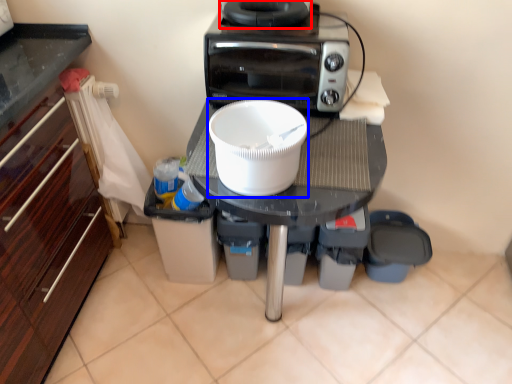
Question: Which of the following is the closest to the observer, appliance (highlighted by a red box) or kitchen appliance (highlighted by a blue box)?

Choices:
 (A) appliance
 (B) kitchen appliance

Answer: (B)